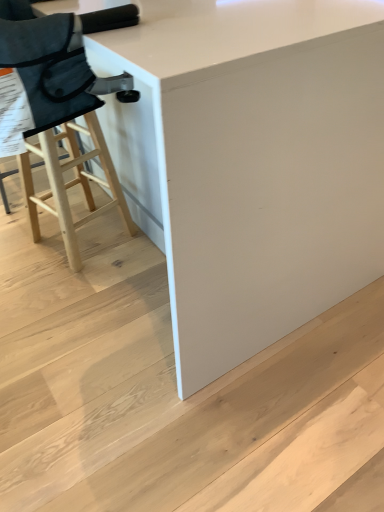
The image size is (384, 512). I want to click on free space above white matte stair at lower center (from a real-world perspective), so click(x=151, y=348).